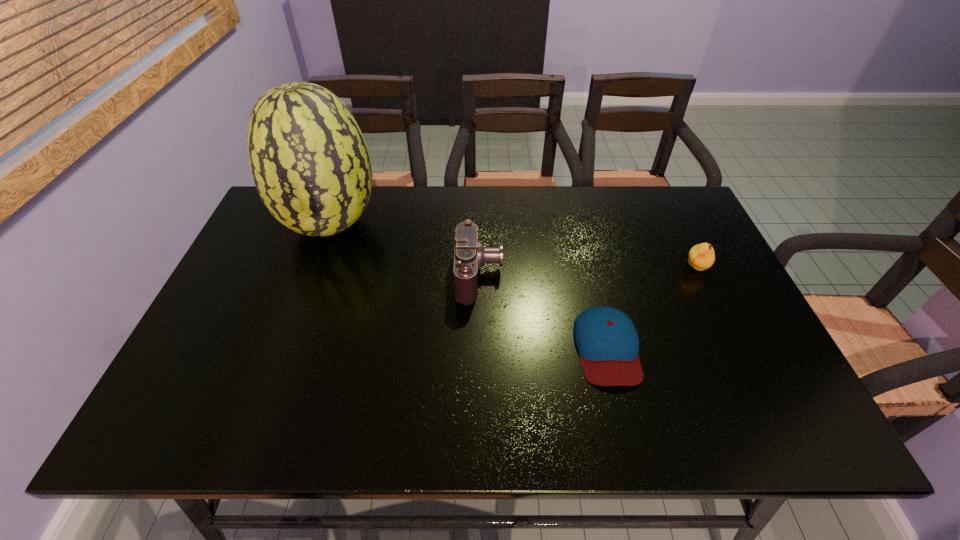
This screenshot has height=540, width=960. What are the coordinates of `vacant space located 0.240m on the front of the pear` in the screenshot? It's located at (736, 352).

Identify the location of object situated at the far edge. (310, 164).

The image size is (960, 540). In order to click on object located at the left edge in this screenshot , I will do `click(310, 164)`.

Where is `object present at the right edge`? This screenshot has height=540, width=960. object present at the right edge is located at coordinates (702, 256).

Identify the location of object located in the far left corner section of the desktop. This screenshot has width=960, height=540. (310, 164).

The image size is (960, 540). I want to click on vacant region at the far edge, so click(x=530, y=223).

Find the location of `vacant space at the near edge`. vacant space at the near edge is located at coordinates (355, 401).

In the image, there is a desktop. What are the coordinates of `vacant region at the left edge` in the screenshot? It's located at (244, 265).

The width and height of the screenshot is (960, 540). In the image, there is a desktop. What are the coordinates of `free space at the far right corner` in the screenshot? It's located at (645, 202).

You are a GUI agent. You are given a task and a screenshot of the screen. Output one action in this format:
    pyautogui.click(x=<x>, y=<y>)
    Task: Click on the vacant region between the second object from left to right and the tallest object
    
    Given the screenshot: What is the action you would take?
    pyautogui.click(x=405, y=250)